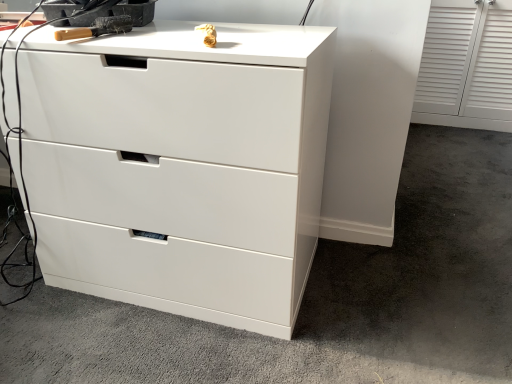
At what (x,y) coordinates should I click in order to perform the action: click on white glossy drawer at center. Please return your answer as a coordinate pair (x, y). Image resolution: width=512 pixels, height=384 pixels. Looking at the image, I should click on (324, 299).

Describe the element at coordinates (97, 28) in the screenshot. The height and width of the screenshot is (384, 512). I see `wooden-handled brush at upper left` at that location.

Where is `white glossy chest of drawers at center`? white glossy chest of drawers at center is located at coordinates (180, 167).

Can white glossy drawer at center be found inside white glossy chest of drawers at center?

That's incorrect, white glossy drawer at center is not inside white glossy chest of drawers at center.

Considering the positions of objects white glossy chest of drawers at center and white glossy drawer at center in the image provided, who is in front, white glossy chest of drawers at center or white glossy drawer at center?

white glossy drawer at center.

Consider the image. Is white glossy chest of drawers at center turned away from white glossy drawer at center?

That's right, white glossy chest of drawers at center is facing away from white glossy drawer at center.

Is point (129, 100) positioned behind point (410, 318)?

No, (129, 100) is closer to viewer.

Looking at this image, considering the positions of objects wooden-handled brush at upper left and white glossy drawer at center in the image provided, who is behind, wooden-handled brush at upper left or white glossy drawer at center?

Result: wooden-handled brush at upper left is further from the camera.

Is wooden-handled brush at upper left facing away from white glossy drawer at center?

wooden-handled brush at upper left does not have its back to white glossy drawer at center.

From the picture: Is wooden-handled brush at upper left located outside white glossy drawer at center?

wooden-handled brush at upper left is positioned outside white glossy drawer at center.

Measure the distance from wooden-handled brush at upper left to white glossy drawer at center.

3.38 feet.

Between white glossy chest of drawers at center and wooden-handled brush at upper left, which one has more height?

white glossy chest of drawers at center is taller.

Considering the relative sizes of white glossy chest of drawers at center and wooden-handled brush at upper left in the image provided, is white glossy chest of drawers at center thinner than wooden-handled brush at upper left?

No, white glossy chest of drawers at center is not thinner than wooden-handled brush at upper left.

Is white glossy chest of drawers at center facing towards wooden-handled brush at upper left?

No, white glossy chest of drawers at center is not facing towards wooden-handled brush at upper left.

Is point (510, 238) closer or farther from the camera than point (87, 30)?

Point (510, 238).

Considering the relative sizes of white glossy drawer at center and wooden-handled brush at upper left in the image provided, is white glossy drawer at center thinner than wooden-handled brush at upper left?

In fact, white glossy drawer at center might be wider than wooden-handled brush at upper left.

Considering the relative sizes of white glossy drawer at center and wooden-handled brush at upper left in the image provided, is white glossy drawer at center smaller than wooden-handled brush at upper left?

Actually, white glossy drawer at center might be larger than wooden-handled brush at upper left.

Between white glossy drawer at center and wooden-handled brush at upper left, which one appears on the left side from the viewer's perspective?

Positioned to the left is wooden-handled brush at upper left.

Does wooden-handled brush at upper left have a larger size compared to white glossy chest of drawers at center?

No.

From the image's perspective, which one is positioned higher, wooden-handled brush at upper left or white glossy chest of drawers at center?

wooden-handled brush at upper left appears higher in the image.

Considering the sizes of wooden-handled brush at upper left and white glossy chest of drawers at center in the image, is wooden-handled brush at upper left taller or shorter than white glossy chest of drawers at center?

Considering their sizes, wooden-handled brush at upper left has less height than white glossy chest of drawers at center.

Would you say wooden-handled brush at upper left is to the left or to the right of white glossy chest of drawers at center in the picture?

From the image, it's evident that wooden-handled brush at upper left is to the left of white glossy chest of drawers at center.

Does white glossy drawer at center touch white glossy chest of drawers at center?

white glossy drawer at center is not next to white glossy chest of drawers at center, and they're not touching.

Looking at this image, who is more distant, white glossy drawer at center or white glossy chest of drawers at center?

Positioned behind is white glossy chest of drawers at center.

Is white glossy drawer at center turned away from white glossy chest of drawers at center?

white glossy drawer at center does not have its back to white glossy chest of drawers at center.

From the image's perspective, who appears lower, white glossy drawer at center or white glossy chest of drawers at center?

white glossy chest of drawers at center, from the image's perspective.

Find the location of a particular element. concrete that appears above the white glossy chest of drawers at center (from the image's perspective) is located at coordinates (324, 299).

Find the location of a particular element. concrete that appears on the right of wooden-handled brush at upper left is located at coordinates (324, 299).

Based on their spatial positions, is white glossy drawer at center or wooden-handled brush at upper left further from white glossy chest of drawers at center?

wooden-handled brush at upper left is positioned further to the anchor white glossy chest of drawers at center.

Based on their spatial positions, is white glossy chest of drawers at center or white glossy drawer at center further from wooden-handled brush at upper left?

Based on the image, white glossy drawer at center appears to be further to wooden-handled brush at upper left.

Based on the photo, when comparing their distances from wooden-handled brush at upper left, does white glossy drawer at center or white glossy chest of drawers at center seem further?

Among the two, white glossy drawer at center is located further to wooden-handled brush at upper left.

Looking at the image, which one is located closer to white glossy chest of drawers at center, wooden-handled brush at upper left or white glossy drawer at center?

white glossy drawer at center is closer to white glossy chest of drawers at center.

Which object lies nearer to the anchor point white glossy drawer at center, white glossy chest of drawers at center or wooden-handled brush at upper left?

Based on the image, white glossy chest of drawers at center appears to be nearer to white glossy drawer at center.

Which object lies further to the anchor point white glossy drawer at center, wooden-handled brush at upper left or white glossy chest of drawers at center?

wooden-handled brush at upper left is further to white glossy drawer at center.

At what (x,y) coordinates should I click in order to perform the action: click on chest of drawers between wooden-handled brush at upper left and white glossy drawer at center from left to right. Please return your answer as a coordinate pair (x, y). The width and height of the screenshot is (512, 384). Looking at the image, I should click on (180, 167).